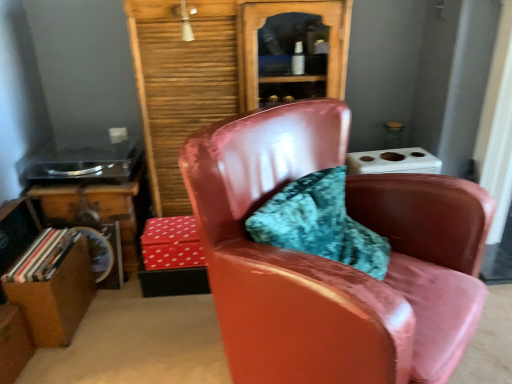
Locate an element on the screen. Image resolution: width=512 pixels, height=384 pixels. wooden table at lower left is located at coordinates (97, 209).

Measure the distance between point (161,262) and camera.

Point (161,262) is 1.72 meters away from camera.

This screenshot has height=384, width=512. In order to click on matte gray power outlet at upper left in this screenshot , I will do `click(118, 134)`.

In order to click on wooden table at lower left in this screenshot , I will do coord(97,209).

Considering the positions of objects wooden table at lower left and matte gray power outlet at upper left in the image provided, who is more to the right, wooden table at lower left or matte gray power outlet at upper left?

Positioned to the right is matte gray power outlet at upper left.

Is wooden table at lower left closer to the viewer compared to matte gray power outlet at upper left?

Yes, wooden table at lower left is closer to the viewer.

Consider the image. Is wooden table at lower left facing away from matte gray power outlet at upper left?

That's not correct — wooden table at lower left is not looking away from matte gray power outlet at upper left.

How different are the orientations of wooden table at lower left and matte gray power outlet at upper left in degrees?

There is a 2.2-degree angle between the facing directions of wooden table at lower left and matte gray power outlet at upper left.

From the image's perspective, between wooden table at lower left and glossy leather chair at center, who is located below?

glossy leather chair at center, from the image's perspective.

Does wooden table at lower left have a greater height compared to glossy leather chair at center?

No, wooden table at lower left is not taller than glossy leather chair at center.

Is point (72, 189) closer to camera compared to point (250, 302)?

No, it is not.

In terms of width, does wooden table at lower left look wider or thinner when compared to glossy leather chair at center?

Considering their sizes, wooden table at lower left looks slimmer than glossy leather chair at center.

Is glossy leather chair at center in front of or behind matte gray power outlet at upper left in the image?

glossy leather chair at center is positioned closer to the viewer than matte gray power outlet at upper left.

From a real-world perspective, who is located lower, glossy leather chair at center or matte gray power outlet at upper left?

In real-world perspective, glossy leather chair at center is lower.

Is glossy leather chair at center bigger than matte gray power outlet at upper left?

Yes, glossy leather chair at center is bigger than matte gray power outlet at upper left.

Is wooden bookcase at center turned away from wooden table at lower left?

No, wooden bookcase at center's orientation is not away from wooden table at lower left.

Who is smaller, wooden bookcase at center or wooden table at lower left?

wooden table at lower left is smaller.

Considering the positions of points (270, 74) and (109, 197), is point (270, 74) farther from camera compared to point (109, 197)?

No.

Measure the distance from red dotted fabric box at center to wooden table at lower left.

red dotted fabric box at center is 11.03 inches away from wooden table at lower left.

Are red dotted fabric box at center and wooden table at lower left making contact?

No, red dotted fabric box at center is not with wooden table at lower left.

Is wooden table at lower left located within red dotted fabric box at center?

Answer: No, wooden table at lower left is not a part of red dotted fabric box at center.

Considering the sizes of objects red dotted fabric box at center and wooden table at lower left in the image provided, who is thinner, red dotted fabric box at center or wooden table at lower left?

wooden table at lower left.

Is glossy leather chair at center to the left of wooden bookcase at center from the viewer's perspective?

Incorrect, glossy leather chair at center is not on the left side of wooden bookcase at center.

Considering the sizes of objects glossy leather chair at center and wooden bookcase at center in the image provided, who is wider, glossy leather chair at center or wooden bookcase at center?

With larger width is glossy leather chair at center.

From the image's perspective, does glossy leather chair at center appear lower than wooden bookcase at center?

Yes, from the image's perspective, glossy leather chair at center is beneath wooden bookcase at center.

Looking at their sizes, would you say matte gray power outlet at upper left is wider or thinner than wooden table at lower left?

matte gray power outlet at upper left is thinner than wooden table at lower left.

Is matte gray power outlet at upper left further to the viewer compared to wooden table at lower left?

Yes, matte gray power outlet at upper left is behind wooden table at lower left.

Between matte gray power outlet at upper left and wooden table at lower left, which one appears on the right side from the viewer's perspective?

matte gray power outlet at upper left.

I want to click on power outlet behind the wooden table at lower left, so click(x=118, y=134).

You are a GUI agent. You are given a task and a screenshot of the screen. Output one action in this format:
    pyautogui.click(x=<x>, y=<y>)
    Task: Click on the chair below the wooden table at lower left (from the image's perspective)
    This screenshot has height=384, width=512.
    Given the screenshot: What is the action you would take?
    pyautogui.click(x=333, y=261)

Looking at this image, considering their positions, is matte gray power outlet at upper left positioned closer to glossy leather chair at center than red dotted fabric box at center?

The object closer to glossy leather chair at center is red dotted fabric box at center.

Estimate the real-world distances between objects in this image. Which object is further from red dotted fabric box at center, wooden bookcase at center or wooden table at lower left?

The object further to red dotted fabric box at center is wooden bookcase at center.

Which object lies nearer to the anchor point wooden table at lower left, glossy leather chair at center or matte gray power outlet at upper left?

matte gray power outlet at upper left lies closer to wooden table at lower left than the other object.

When comparing their distances from matte gray power outlet at upper left, does wooden table at lower left or glossy leather chair at center seem further?

glossy leather chair at center.

From the image, which object appears to be farther from wooden table at lower left, red dotted fabric box at center or wooden bookcase at center?

Based on the image, wooden bookcase at center appears to be further to wooden table at lower left.

From the image, which object appears to be nearer to red dotted fabric box at center, glossy leather chair at center or wooden bookcase at center?

wooden bookcase at center lies closer to red dotted fabric box at center than the other object.

Estimate the real-world distances between objects in this image. Which object is closer to glossy leather chair at center, red dotted fabric box at center or wooden bookcase at center?

wooden bookcase at center.

Estimate the real-world distances between objects in this image. Which object is closer to wooden bookcase at center, matte gray power outlet at upper left or red dotted fabric box at center?

red dotted fabric box at center.

The height and width of the screenshot is (384, 512). In order to click on table between glossy leather chair at center and matte gray power outlet at upper left along the z-axis in this screenshot , I will do `click(97, 209)`.

You are a GUI agent. You are given a task and a screenshot of the screen. Output one action in this format:
    pyautogui.click(x=<x>, y=<y>)
    Task: Click on the bookcase between glossy leather chair at center and wooden table at lower left in the front-back direction
    This screenshot has width=512, height=384.
    Given the screenshot: What is the action you would take?
    pyautogui.click(x=227, y=70)

Locate an element on the screen. The height and width of the screenshot is (384, 512). power outlet between wooden table at lower left and wooden bookcase at center in the horizontal direction is located at coordinates (118, 134).

Locate an element on the screen. The width and height of the screenshot is (512, 384). bookcase between glossy leather chair at center and matte gray power outlet at upper left from front to back is located at coordinates (227, 70).